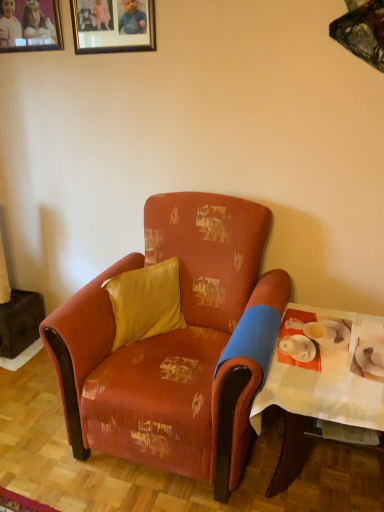
Question: Can you confirm if gold-framed picture at upper center, marked as the 1th picture frame in a right-to-left arrangement, is thinner than satin yellow pillow at center?

Choices:
 (A) yes
 (B) no

Answer: (A)

Question: Considering the relative positions of gold-framed picture at upper center, placed as the 2th picture frame when sorted from left to right, and satin yellow pillow at center in the image provided, is gold-framed picture at upper center, placed as the 2th picture frame when sorted from left to right, to the left of satin yellow pillow at center from the viewer's perspective?

Choices:
 (A) yes
 (B) no

Answer: (A)

Question: Is gold-framed picture at upper center, placed as the 2th picture frame when sorted from left to right, smaller than satin yellow pillow at center?

Choices:
 (A) yes
 (B) no

Answer: (A)

Question: Is gold-framed picture at upper center, marked as the 1th picture frame in a right-to-left arrangement, not inside satin yellow pillow at center?

Choices:
 (A) yes
 (B) no

Answer: (A)

Question: Does gold-framed picture at upper center, placed as the 2th picture frame when sorted from left to right, have a greater height compared to satin yellow pillow at center?

Choices:
 (A) no
 (B) yes

Answer: (B)

Question: Is gold-framed picture at upper center, placed as the 2th picture frame when sorted from left to right, facing towards satin yellow pillow at center?

Choices:
 (A) no
 (B) yes

Answer: (A)

Question: Considering the relative sizes of distressed fabric armchair at center and satin yellow pillow at center in the image provided, is distressed fabric armchair at center wider than satin yellow pillow at center?

Choices:
 (A) no
 (B) yes

Answer: (B)

Question: Is distressed fabric armchair at center far from satin yellow pillow at center?

Choices:
 (A) no
 (B) yes

Answer: (A)

Question: Is distressed fabric armchair at center further to camera compared to satin yellow pillow at center?

Choices:
 (A) yes
 (B) no

Answer: (B)

Question: Would you say distressed fabric armchair at center is outside satin yellow pillow at center?

Choices:
 (A) yes
 (B) no

Answer: (A)

Question: From a real-world perspective, is distressed fabric armchair at center on satin yellow pillow at center?

Choices:
 (A) no
 (B) yes

Answer: (A)

Question: Can you confirm if distressed fabric armchair at center is smaller than satin yellow pillow at center?

Choices:
 (A) no
 (B) yes

Answer: (A)

Question: Is the depth of white paper table at right greater than that of matte wooden picture frame at upper left, arranged as the second picture frame when viewed from the right?

Choices:
 (A) yes
 (B) no

Answer: (B)